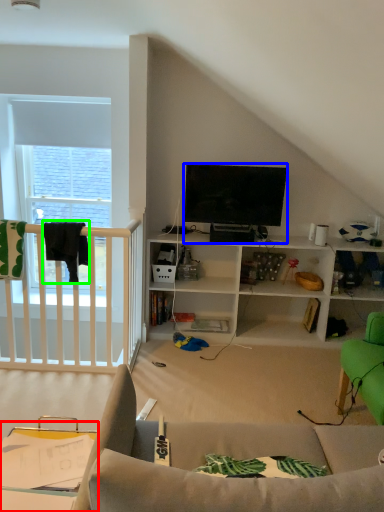
Question: Which object is positioned closest to table (highlighted by a red box)? Select from television (highlighted by a blue box) and clothesline (highlighted by a green box).

Choices:
 (A) television
 (B) clothesline

Answer: (B)